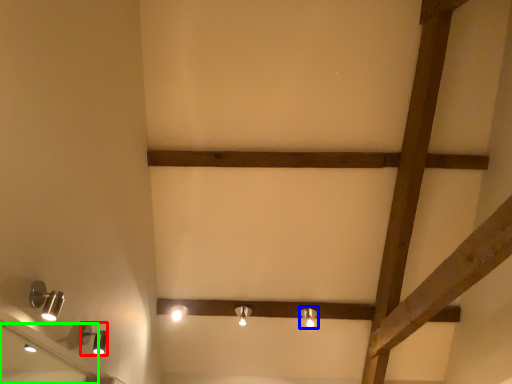
Question: Estimate the real-world distances between objects in this image. Which object is farther from lamp (highlighted by a red box), lamp (highlighted by a blue box) or mirror (highlighted by a green box)?

Choices:
 (A) lamp
 (B) mirror

Answer: (A)